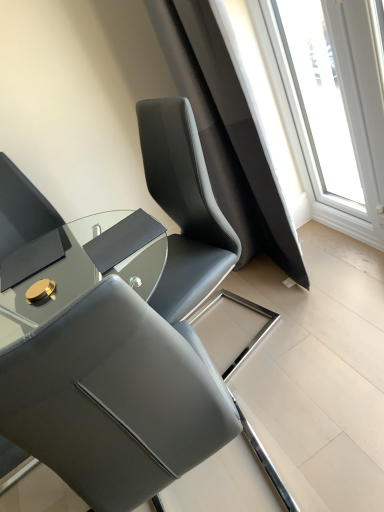
Question: From the image's perspective, is transparent glass window at upper right under shiny black glass table at center?

Choices:
 (A) no
 (B) yes

Answer: (A)

Question: Is transparent glass window at upper right outside shiny black glass table at center?

Choices:
 (A) no
 (B) yes

Answer: (B)

Question: Considering the relative sizes of transparent glass window at upper right and shiny black glass table at center in the image provided, is transparent glass window at upper right wider than shiny black glass table at center?

Choices:
 (A) yes
 (B) no

Answer: (B)

Question: Is transparent glass window at upper right directly adjacent to shiny black glass table at center?

Choices:
 (A) yes
 (B) no

Answer: (B)

Question: Is transparent glass window at upper right positioned in front of shiny black glass table at center?

Choices:
 (A) yes
 (B) no

Answer: (B)

Question: Which is correct: shiny black glass table at center is inside transparent glass window at upper right, or outside of it?

Choices:
 (A) inside
 (B) outside

Answer: (B)

Question: Does point (129, 283) appear closer or farther from the camera than point (292, 129)?

Choices:
 (A) closer
 (B) farther

Answer: (A)

Question: In terms of height, does shiny black glass table at center look taller or shorter compared to transparent glass window at upper right?

Choices:
 (A) tall
 (B) short

Answer: (B)

Question: From a real-world perspective, is shiny black glass table at center above or below transparent glass window at upper right?

Choices:
 (A) above
 (B) below

Answer: (A)

Question: From the image's perspective, relative to shiny black glass table at center, is transparent glass window at upper right above or below?

Choices:
 (A) above
 (B) below

Answer: (A)

Question: In the image, is transparent glass window at upper right positioned in front of or behind shiny black glass table at center?

Choices:
 (A) front
 (B) behind

Answer: (B)

Question: Is transparent glass window at upper right bigger or smaller than shiny black glass table at center?

Choices:
 (A) big
 (B) small

Answer: (B)

Question: From a real-world perspective, is transparent glass window at upper right positioned above or below shiny black glass table at center?

Choices:
 (A) below
 (B) above

Answer: (A)

Question: From the image's perspective, relative to shiny black glass table at center, is matte gray chair at center above or below?

Choices:
 (A) above
 (B) below

Answer: (B)

Question: Based on their sizes in the image, would you say matte gray chair at center is bigger or smaller than shiny black glass table at center?

Choices:
 (A) small
 (B) big

Answer: (B)